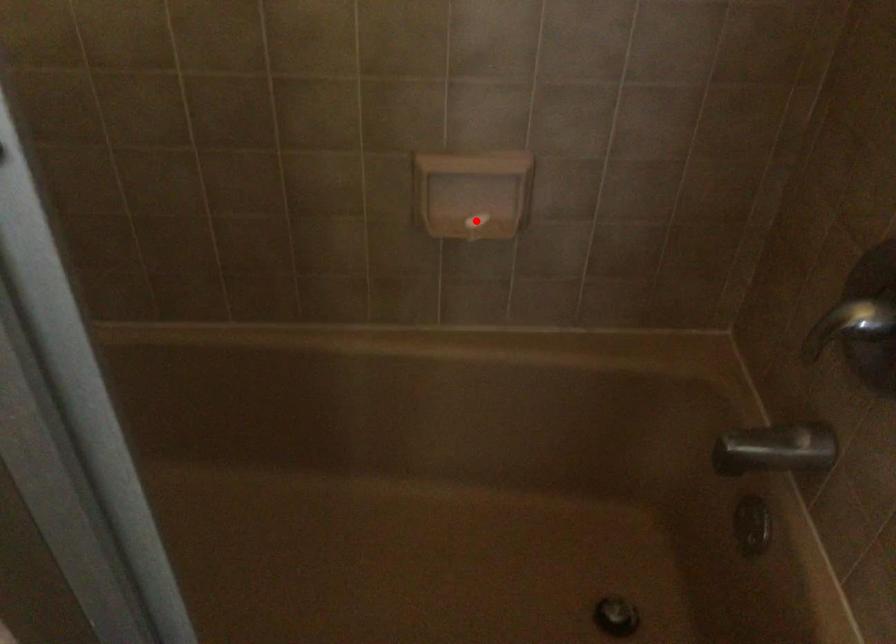
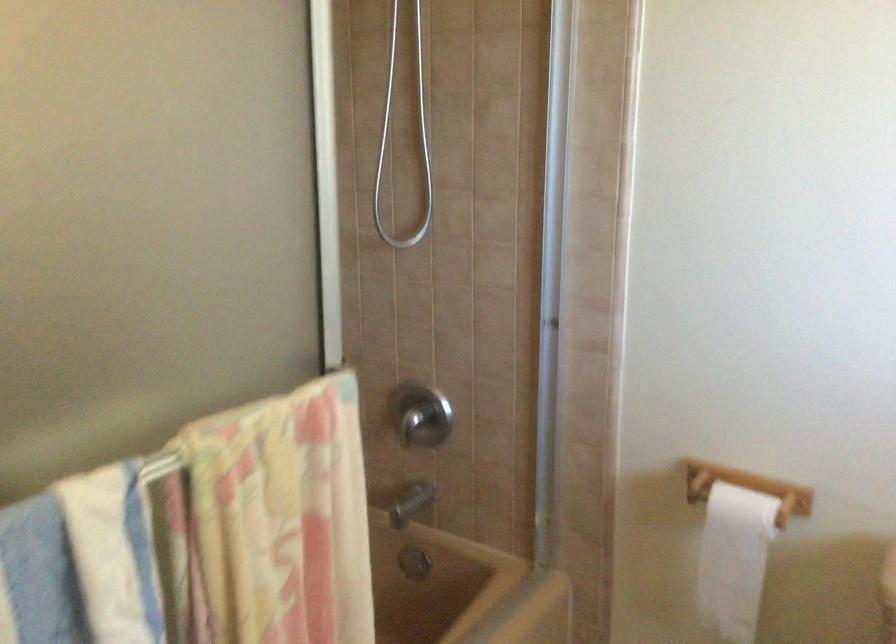
Question: I am providing you with two images of the same scene from different viewpoints. A red point is marked on the first image. Can you still see the location of the red point in image 2?

Choices:
 (A) Yes
 (B) No

Answer: (B)